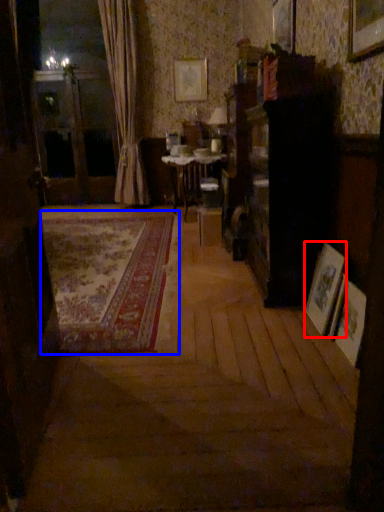
Question: Which object is closer to the camera taking this photo, picture frame (highlighted by a red box) or plain (highlighted by a blue box)?

Choices:
 (A) picture frame
 (B) plain

Answer: (A)